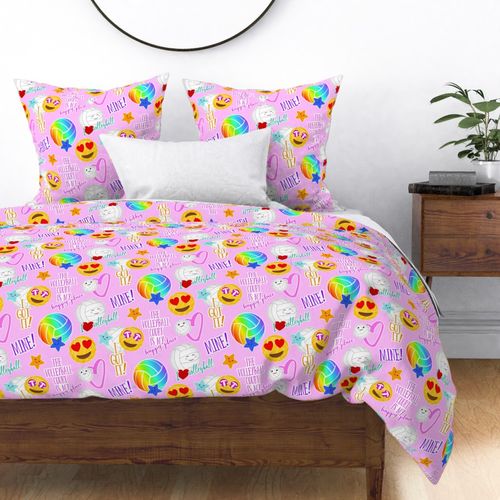
At what (x,y) coordinates should I click in order to perform the action: click on wooden floor. Please return your answer as a coordinate pair (x, y). Image resolution: width=500 pixels, height=500 pixels. Looking at the image, I should click on (475, 473).